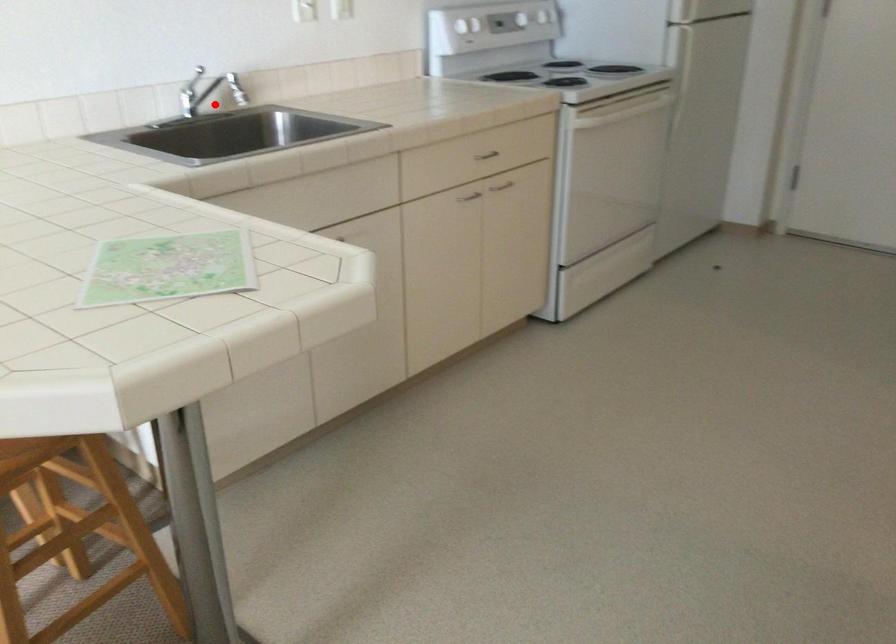
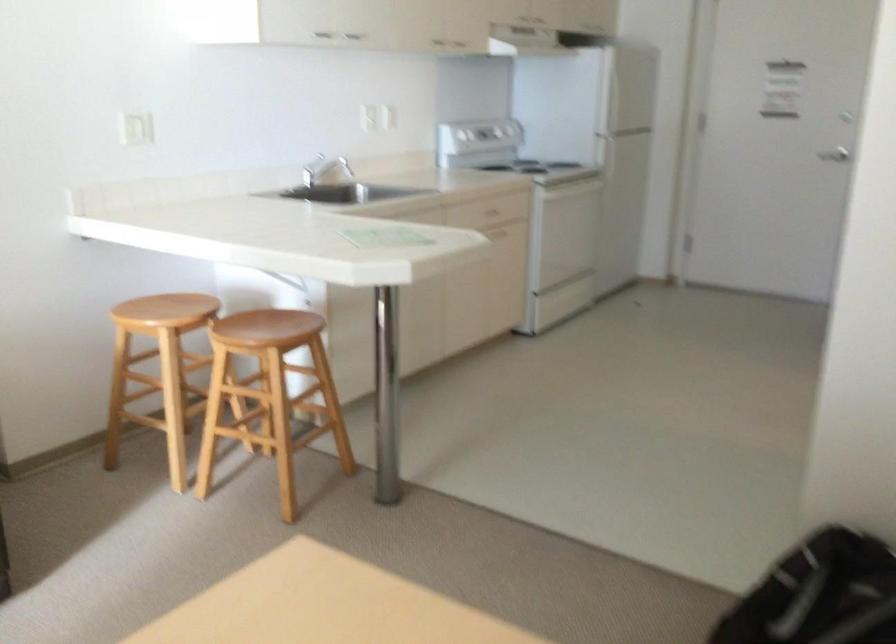
Question: I am providing you with two images of the same scene from different viewpoints. A red point is marked on the first image. At the location where the point appears in image 1, is it still visible in image 2?

Choices:
 (A) Yes
 (B) No

Answer: (A)